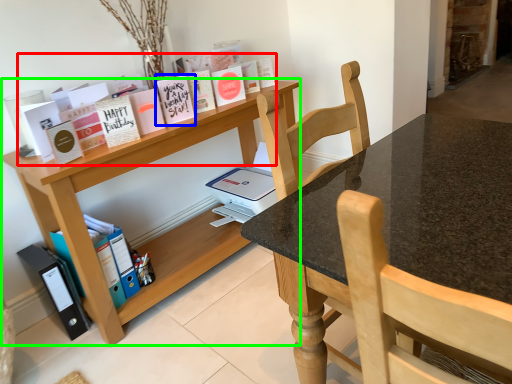
Question: Considering the real-world distances, which object is farthest from book (highlighted by a red box)? paperback book (highlighted by a blue box) or shelf (highlighted by a green box)?

Choices:
 (A) paperback book
 (B) shelf

Answer: (B)